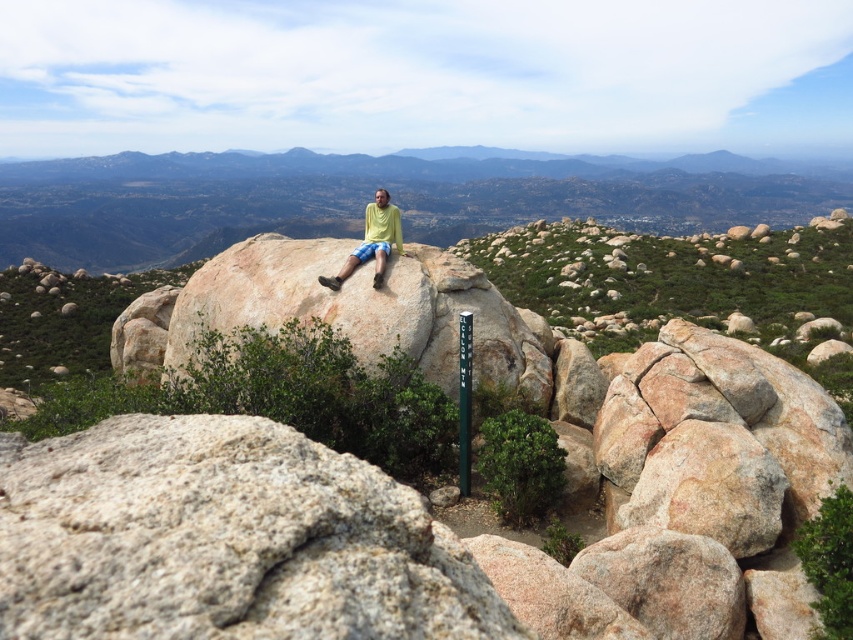
Question: Does gray granite boulder at center come in front of matte yellow shirt at center?

Choices:
 (A) yes
 (B) no

Answer: (A)

Question: Does gray granite boulder at center lie in front of matte yellow shirt at center?

Choices:
 (A) yes
 (B) no

Answer: (A)

Question: Which point appears closest to the camera in this image?

Choices:
 (A) (91, 624)
 (B) (177, 234)
 (C) (381, 236)

Answer: (A)

Question: Estimate the real-world distances between objects in this image. Which object is closer to the gray granite boulder at center?

Choices:
 (A) smooth granite boulder at center
 (B) matte yellow shirt at center

Answer: (B)

Question: Is smooth granite boulder at center to the left of matte yellow shirt at center from the viewer's perspective?

Choices:
 (A) no
 (B) yes

Answer: (A)

Question: Which point is farther from the camera taking this photo?

Choices:
 (A) pos(64,172)
 (B) pos(73,472)

Answer: (A)